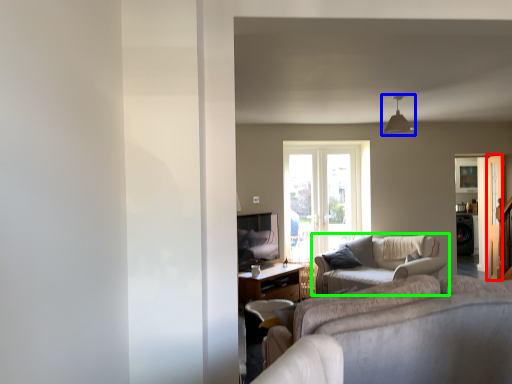
Question: Which object is the closest to the screen door (highlighted by a red box)? Choose among these: light fixture (highlighted by a blue box) or studio couch (highlighted by a green box).

Choices:
 (A) light fixture
 (B) studio couch

Answer: (A)